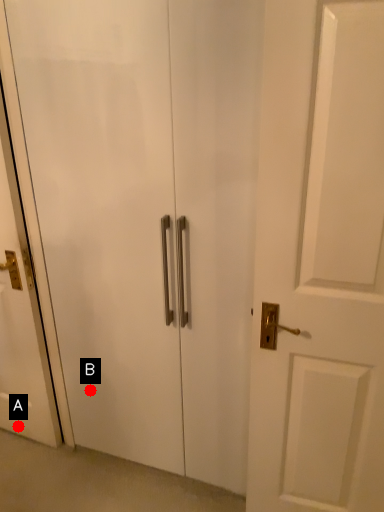
Question: Two points are circled on the image, labeled by A and B beside each circle. Which point appears closest to the camera in this image?

Choices:
 (A) A is closer
 (B) B is closer

Answer: (B)